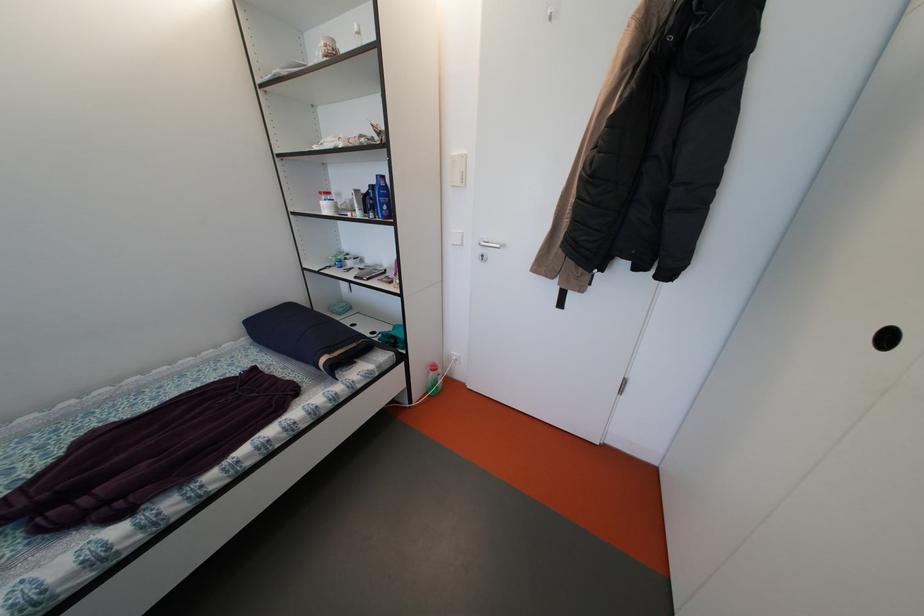
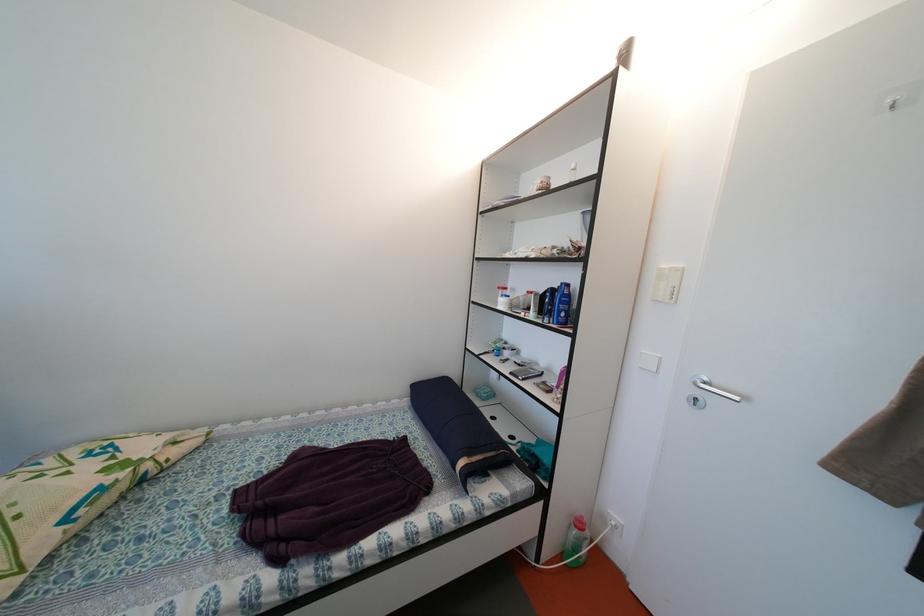
In the second image, find the point that corresponds to (458,182) in the first image.

(662, 294)